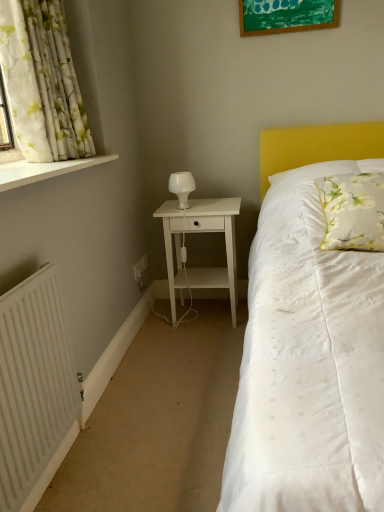
What do you see at coordinates (353, 211) in the screenshot? The image size is (384, 512). I see `white floral fabric pillow at upper right` at bounding box center [353, 211].

Find the location of a particular element. The image size is (384, 512). white plastic electric outlet at lower left, the first electric outlet when ordered from back to front is located at coordinates pos(143,262).

This screenshot has width=384, height=512. What do you see at coordinates (143, 262) in the screenshot? I see `white plastic electric outlet at lower left, the first electric outlet when ordered from back to front` at bounding box center [143, 262].

At what (x,y) coordinates should I click in order to perform the action: click on white plastic electric outlet at lower left, which is counted as the 1th electric outlet, starting from the front. Please return your answer as a coordinate pair (x, y). The width and height of the screenshot is (384, 512). Looking at the image, I should click on (140, 268).

Describe the element at coordinates (42, 81) in the screenshot. I see `white floral fabric curtain at left` at that location.

At what (x,y) coordinates should I click in order to perform the action: click on white glossy window sill at upper left. Please return your answer as a coordinate pair (x, y). Looking at the image, I should click on (43, 170).

In the scene shown: Measure the distance between green matte picture frame at upper center and camera.

A distance of 2.22 meters exists between green matte picture frame at upper center and camera.

Where is `white floral fabric pillow at upper right`? white floral fabric pillow at upper right is located at coordinates (353, 211).

Where is `pillow that is below the white frosted glass table lamp at center (from the image's perspective)`? This screenshot has height=512, width=384. pillow that is below the white frosted glass table lamp at center (from the image's perspective) is located at coordinates (353, 211).

Is the position of white frosted glass table lamp at center less distant than that of white floral fabric pillow at upper right?

No.

Choose the correct answer: Is white frosted glass table lamp at center inside white floral fabric pillow at upper right or outside it?

The correct answer is: outside.

From a real-world perspective, is white frosted glass table lamp at center on top of white floral fabric pillow at upper right?

Indeed, from a real-world perspective, white frosted glass table lamp at center stands above white floral fabric pillow at upper right.

Could you measure the distance between white frosted glass table lamp at center and white glossy window sill at upper left?

The distance of white frosted glass table lamp at center from white glossy window sill at upper left is 24.84 inches.

This screenshot has height=512, width=384. What are the coordinates of `window sill that appears below the white frosted glass table lamp at center (from the image's perspective)` in the screenshot? It's located at (43, 170).

Considering the relative sizes of white frosted glass table lamp at center and white glossy window sill at upper left in the image provided, is white frosted glass table lamp at center shorter than white glossy window sill at upper left?

No, white frosted glass table lamp at center is not shorter than white glossy window sill at upper left.

What's the angular difference between white frosted glass table lamp at center and white glossy window sill at upper left's facing directions?

The facing directions of white frosted glass table lamp at center and white glossy window sill at upper left are 89.2 degrees apart.

Considering the sizes of objects white ribbed radiator at lower left and white floral fabric pillow at upper right in the image provided, who is bigger, white ribbed radiator at lower left or white floral fabric pillow at upper right?

white floral fabric pillow at upper right.

Is white ribbed radiator at lower left aimed at white floral fabric pillow at upper right?

No.

How different are the orientations of white ribbed radiator at lower left and white floral fabric pillow at upper right in degrees?

There is a 93.7-degree angle between the facing directions of white ribbed radiator at lower left and white floral fabric pillow at upper right.

Does white floral fabric pillow at upper right have a lesser height compared to white plastic electric outlet at lower left, which is counted as the 2th electric outlet, starting from the back?

No.

How much distance is there between white floral fabric pillow at upper right and white plastic electric outlet at lower left, which is counted as the 1th electric outlet, starting from the front?

4.35 feet.

Which is in front, point (365, 241) or point (134, 277)?

The point (365, 241) is closer to the camera.

The height and width of the screenshot is (512, 384). In order to click on pillow positioned vertically above the white plastic electric outlet at lower left, which is counted as the 2th electric outlet, starting from the back (from a real-world perspective) in this screenshot , I will do `click(353, 211)`.

Consider the image. Could you tell me if white plastic electric outlet at lower left, the first electric outlet when ordered from back to front, is facing white glossy window sill at upper left?

No, white plastic electric outlet at lower left, the first electric outlet when ordered from back to front, does not turn towards white glossy window sill at upper left.

Does white plastic electric outlet at lower left, positioned as the second electric outlet in front-to-back order, have a larger size compared to white glossy window sill at upper left?

No, white plastic electric outlet at lower left, positioned as the second electric outlet in front-to-back order, is not bigger than white glossy window sill at upper left.

In terms of height, does white plastic electric outlet at lower left, positioned as the second electric outlet in front-to-back order, look taller or shorter compared to white glossy window sill at upper left?

Clearly, white plastic electric outlet at lower left, positioned as the second electric outlet in front-to-back order, is taller compared to white glossy window sill at upper left.

Based on their positions, is white plastic electric outlet at lower left, which is counted as the 1th electric outlet, starting from the front, located to the left or right of green matte picture frame at upper center?

From the image, it's evident that white plastic electric outlet at lower left, which is counted as the 1th electric outlet, starting from the front, is to the left of green matte picture frame at upper center.

Considering the relative sizes of white plastic electric outlet at lower left, which is counted as the 1th electric outlet, starting from the front, and green matte picture frame at upper center in the image provided, is white plastic electric outlet at lower left, which is counted as the 1th electric outlet, starting from the front, shorter than green matte picture frame at upper center?

Yes.

Based on the photo, how different are the orientations of white plastic electric outlet at lower left, which is counted as the 2th electric outlet, starting from the back, and green matte picture frame at upper center in degrees?

They differ by 88.3 degrees in their facing directions.

Considering the relative sizes of white plastic electric outlet at lower left, the first electric outlet when ordered from back to front, and white ribbed radiator at lower left in the image provided, is white plastic electric outlet at lower left, the first electric outlet when ordered from back to front, bigger than white ribbed radiator at lower left?

Actually, white plastic electric outlet at lower left, the first electric outlet when ordered from back to front, might be smaller than white ribbed radiator at lower left.

From the image's perspective, is white plastic electric outlet at lower left, the first electric outlet when ordered from back to front, located beneath white ribbed radiator at lower left?

Actually, white plastic electric outlet at lower left, the first electric outlet when ordered from back to front, appears above white ribbed radiator at lower left in the image.

Is white plastic electric outlet at lower left, the first electric outlet when ordered from back to front, oriented away from white ribbed radiator at lower left?

No, white plastic electric outlet at lower left, the first electric outlet when ordered from back to front, is not facing the opposite direction of white ribbed radiator at lower left.

Measure the distance between white plastic electric outlet at lower left, the first electric outlet when ordered from back to front, and white ribbed radiator at lower left.

4.46 feet.

I want to click on pillow on the right side of white frosted glass table lamp at center, so click(x=353, y=211).

I want to click on window sill on the left of white frosted glass table lamp at center, so click(43, 170).

Which object lies nearer to the anchor point green matte picture frame at upper center, white matte nightstand at center or white floral fabric curtain at left?

white matte nightstand at center.

Looking at the image, which one is located further to white glossy window sill at upper left, white floral fabric curtain at left or white plastic electric outlet at lower left, which is counted as the 1th electric outlet, starting from the front?

Based on the image, white plastic electric outlet at lower left, which is counted as the 1th electric outlet, starting from the front, appears to be further to white glossy window sill at upper left.

Consider the image. When comparing their distances from white plastic electric outlet at lower left, the first electric outlet when ordered from back to front, does white floral fabric pillow at upper right or green matte picture frame at upper center seem closer?

white floral fabric pillow at upper right is positioned closer to the anchor white plastic electric outlet at lower left, the first electric outlet when ordered from back to front.

In the scene shown: Based on their spatial positions, is white glossy window sill at upper left or green matte picture frame at upper center closer to white matte nightstand at center?

Among the two, white glossy window sill at upper left is located nearer to white matte nightstand at center.

Looking at this image, which object lies nearer to the anchor point white floral fabric pillow at upper right, white ribbed radiator at lower left or white matte nightstand at center?

white matte nightstand at center is closer to white floral fabric pillow at upper right.

From the image, which object appears to be nearer to white floral fabric curtain at left, white matte nightstand at center or white frosted glass table lamp at center?

white frosted glass table lamp at center is closer to white floral fabric curtain at left.

Based on their spatial positions, is white plastic electric outlet at lower left, positioned as the second electric outlet in front-to-back order, or white matte nightstand at center further from white frosted glass table lamp at center?

white plastic electric outlet at lower left, positioned as the second electric outlet in front-to-back order, lies further to white frosted glass table lamp at center than the other object.

When comparing their distances from white plastic electric outlet at lower left, which is counted as the 2th electric outlet, starting from the back, does white matte nightstand at center or white glossy window sill at upper left seem further?

white glossy window sill at upper left is further to white plastic electric outlet at lower left, which is counted as the 2th electric outlet, starting from the back.

Where is `electric outlet between green matte picture frame at upper center and white plastic electric outlet at lower left, which is counted as the 2th electric outlet, starting from the back, in the up-down direction`? This screenshot has height=512, width=384. electric outlet between green matte picture frame at upper center and white plastic electric outlet at lower left, which is counted as the 2th electric outlet, starting from the back, in the up-down direction is located at coordinates click(143, 262).

Find the location of a particular element. table lamp between white plastic electric outlet at lower left, which is counted as the 2th electric outlet, starting from the back, and white floral fabric pillow at upper right is located at coordinates (182, 187).

Where is `pillow located between white ribbed radiator at lower left and white plastic electric outlet at lower left, positioned as the second electric outlet in front-to-back order, in the depth direction`? pillow located between white ribbed radiator at lower left and white plastic electric outlet at lower left, positioned as the second electric outlet in front-to-back order, in the depth direction is located at coordinates (353, 211).

This screenshot has width=384, height=512. I want to click on window sill that lies between green matte picture frame at upper center and white plastic electric outlet at lower left, which is counted as the 1th electric outlet, starting from the front, from top to bottom, so click(x=43, y=170).